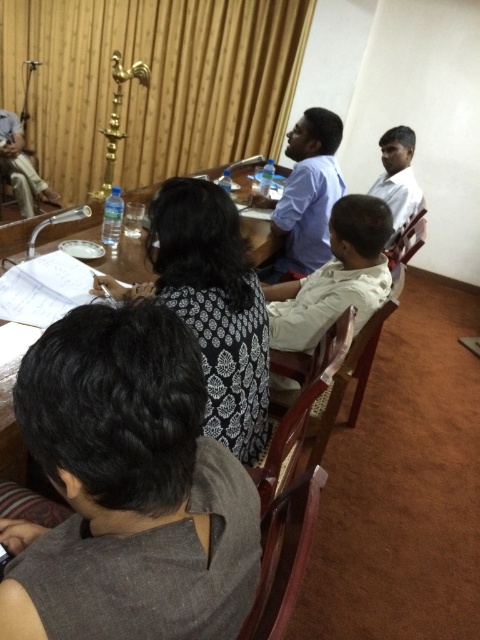
You are standing at the entrance of the meeting room and see two points marked on the floor. The first point is at coordinate point [290,236] and the second is at point [0,113]. If you want to move from the entrance to the first point without crossing the second point, which direction should you move relative to the second point?

Since point [290,236] is in front of point [0,113], you should move forward from the entrance towards the first point without crossing the second point by staying ahead of the second point.

You are a person who is 5 feet tall and standing at the edge of the wooden table at center. You want to reach the white cotton shirt at center to hand someone a document. Can you comfortably reach it without moving your feet?

A: The wooden table at center and white cotton shirt at center are 20.17 inches apart. Since 20.17 inches is approximately 1.68 feet, and the average comfortable reaching distance for someone 5 feet tall is about 2 feet, you might need to stretch slightly but it should be possible to reach the white cotton shirt at center without moving your feet.